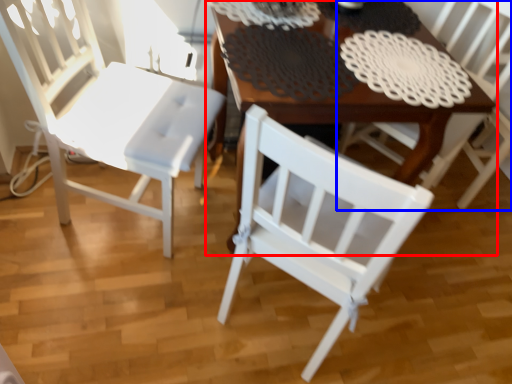
Question: Which of the following is the farthest to the observer, table (highlighted by a red box) or chair (highlighted by a blue box)?

Choices:
 (A) table
 (B) chair

Answer: (B)